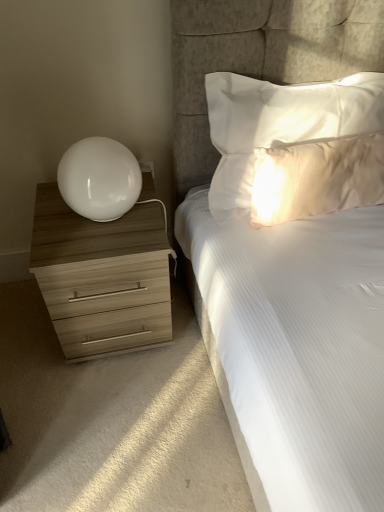
Question: From a real-world perspective, is wooden chest of drawers at left positioned above or below white satin pillow at upper right, the first pillow in the top-to-bottom sequence?

Choices:
 (A) above
 (B) below

Answer: (B)

Question: Does point (91, 295) appear closer or farther from the camera than point (206, 89)?

Choices:
 (A) closer
 (B) farther

Answer: (B)

Question: Which object is positioned farthest from the white satin pillow at upper right, the first pillow in the top-to-bottom sequence?

Choices:
 (A) satin white pillow at upper right, which ranks as the 2th pillow in top-to-bottom order
 (B) wooden chest of drawers at left
 (C) white glossy table lamp at left

Answer: (B)

Question: Which of these objects is positioned farthest from the white glossy table lamp at left?

Choices:
 (A) white satin pillow at upper right, the second pillow ordered from the bottom
 (B) satin white pillow at upper right, which ranks as the first pillow in bottom-to-top order
 (C) wooden chest of drawers at left

Answer: (B)